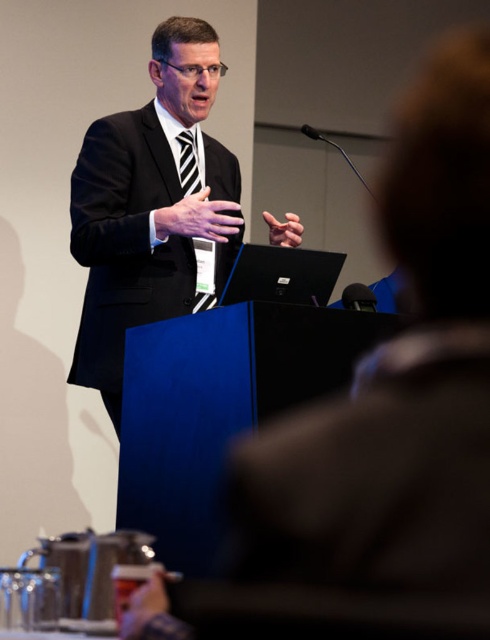
Question: Is black matte suit at center to the right of black striped tie at center from the viewer's perspective?

Choices:
 (A) no
 (B) yes

Answer: (A)

Question: Is black matte suit at center below black striped tie at center?

Choices:
 (A) yes
 (B) no

Answer: (A)

Question: Which object is farther from the camera taking this photo?

Choices:
 (A) black striped tie at center
 (B) black matte suit at center

Answer: (A)

Question: Which point is closer to the camera?

Choices:
 (A) black striped tie at center
 (B) black matte suit at center

Answer: (B)

Question: Does black matte suit at center appear on the left side of black striped tie at center?

Choices:
 (A) yes
 (B) no

Answer: (A)